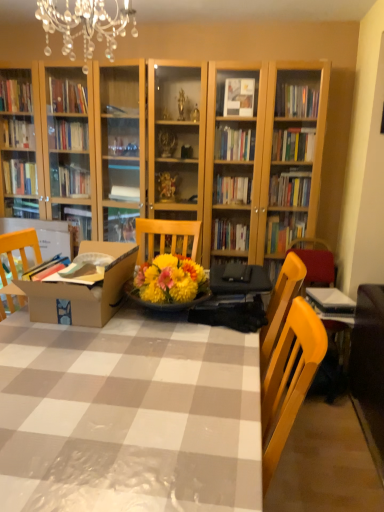
Describe the element at coordinates (83, 290) in the screenshot. I see `brown cardboard box at center` at that location.

The image size is (384, 512). In order to click on brown cardboard box at center in this screenshot , I will do `click(83, 290)`.

Between brown cardboard box at center and wooden table at center, which one has less height?

brown cardboard box at center.

Between brown cardboard box at center and wooden table at center, which one has smaller width?

Thinner between the two is brown cardboard box at center.

Which point is more distant from viewer, (93, 286) or (55, 424)?

The point (93, 286) is more distant.

From the picture: From a real-world perspective, is brown cardboard box at center on wooden table at center?

Yes, from a real-world perspective, brown cardboard box at center is on top of wooden table at center.

Is point (73, 406) closer or farther from the camera than point (290, 244)?

Point (73, 406) is closer to the camera than point (290, 244).

Is wooden table at center not close to yellow wood chair at right?

wooden table at center is far away from yellow wood chair at right.

Considering the relative sizes of wooden table at center and yellow wood chair at right in the image provided, is wooden table at center taller than yellow wood chair at right?

No.

Is wooden table at center surrounding yellow wood chair at right?

Definitely not — yellow wood chair at right is not inside wooden table at center.

Who is smaller, crystal chandelier at upper center or brown cardboard box at center?

Smaller between the two is brown cardboard box at center.

What are the coordinates of `light fixture on the right of the brown cardboard box at center` in the screenshot? It's located at (86, 26).

Does point (37, 9) lie behind point (130, 251)?

Yes.

Where is `light fixture in front of the yellow wood chair at right`? The height and width of the screenshot is (512, 384). light fixture in front of the yellow wood chair at right is located at coordinates (86, 26).

Who is shorter, crystal chandelier at upper center or yellow wood chair at right?

crystal chandelier at upper center is shorter.

Is yellow wood chair at right thinner than crystal chandelier at upper center?

No.

From the picture: Is yellow wood chair at right far from crystal chandelier at upper center?

Yes, yellow wood chair at right and crystal chandelier at upper center are quite far apart.

Which is more to the left, yellow wood chair at right or crystal chandelier at upper center?

crystal chandelier at upper center.

From a real-world perspective, between wooden table at center and brown cardboard box at center, who is vertically higher?

In real-world perspective, brown cardboard box at center is above.

Is brown cardboard box at center surrounded by wooden table at center?

No, wooden table at center does not contain brown cardboard box at center.

Considering the sizes of objects wooden table at center and brown cardboard box at center in the image provided, who is taller, wooden table at center or brown cardboard box at center?

With more height is wooden table at center.

Which object is further away from the camera taking this photo, wooden table at center or brown cardboard box at center?

Positioned behind is brown cardboard box at center.

In terms of height, does yellow wood chair at right look taller or shorter compared to brown cardboard box at center?

Clearly, yellow wood chair at right is taller compared to brown cardboard box at center.

Looking at this image, could you tell me if yellow wood chair at right is turned towards brown cardboard box at center?

No, yellow wood chair at right does not turn towards brown cardboard box at center.

Does yellow wood chair at right have a greater width compared to brown cardboard box at center?

Incorrect, the width of yellow wood chair at right does not surpass that of brown cardboard box at center.

Looking at this image, measure the distance from yellow wood chair at right to brown cardboard box at center.

yellow wood chair at right is 1.57 meters from brown cardboard box at center.

Image resolution: width=384 pixels, height=512 pixels. I want to click on cardboard box lying behind the wooden table at center, so click(x=83, y=290).

You are a GUI agent. You are given a task and a screenshot of the screen. Output one action in this format:
    pyautogui.click(x=<x>, y=<y>)
    Task: Click on the table on the left of yellow wood chair at right
    This screenshot has height=512, width=384.
    Given the screenshot: What is the action you would take?
    pyautogui.click(x=129, y=416)

From the image, which object appears to be nearer to wooden table at center, yellow wood chair at right or brown cardboard box at center?

brown cardboard box at center.

Estimate the real-world distances between objects in this image. Which object is further from yellow wood chair at right, brown cardboard box at center or wooden table at center?

wooden table at center.

Which object lies further to the anchor point yellow wood chair at right, crystal chandelier at upper center or brown cardboard box at center?

crystal chandelier at upper center is further to yellow wood chair at right.

From the image, which object appears to be nearer to crystal chandelier at upper center, brown cardboard box at center or yellow wood chair at right?

The object closer to crystal chandelier at upper center is brown cardboard box at center.

From the image, which object appears to be nearer to wooden table at center, crystal chandelier at upper center or yellow wood chair at right?

crystal chandelier at upper center is closer to wooden table at center.

Which object lies nearer to the anchor point brown cardboard box at center, yellow wood chair at right or wooden table at center?

wooden table at center is positioned closer to the anchor brown cardboard box at center.

In the scene shown: When comparing their distances from brown cardboard box at center, does crystal chandelier at upper center or wooden table at center seem further?

crystal chandelier at upper center lies further to brown cardboard box at center than the other object.

Based on their spatial positions, is yellow wood chair at right or crystal chandelier at upper center further from brown cardboard box at center?

yellow wood chair at right.

The height and width of the screenshot is (512, 384). What are the coordinates of `light fixture between brown cardboard box at center and yellow wood chair at right in the horizontal direction` in the screenshot? It's located at (86, 26).

The width and height of the screenshot is (384, 512). In order to click on cardboard box between crystal chandelier at upper center and wooden table at center in the vertical direction in this screenshot , I will do pos(83,290).

Identify the location of cardboard box between wooden table at center and yellow wood chair at right in the front-back direction. (83, 290).

This screenshot has width=384, height=512. I want to click on armchair between crystal chandelier at upper center and wooden table at center vertically, so click(315, 262).